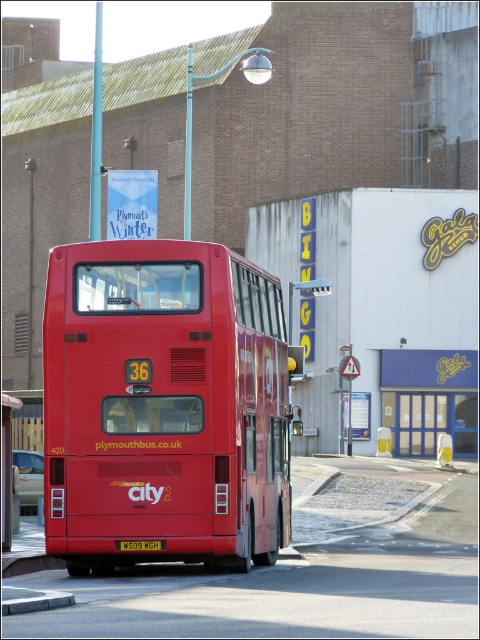
Question: Is metallic silver pole at left above yellow matte license plate at rear?

Choices:
 (A) yes
 (B) no

Answer: (B)

Question: Is metallic silver pole at left wider than yellow matte license plate at rear?

Choices:
 (A) no
 (B) yes

Answer: (A)

Question: Which point is closer to the camera taking this photo?

Choices:
 (A) (90, 470)
 (B) (156, 540)

Answer: (B)

Question: Is matte red bus at center smaller than yellow matte license plate at rear?

Choices:
 (A) no
 (B) yes

Answer: (A)

Question: Which object is positioned farthest from the metallic silver pole at left?

Choices:
 (A) yellow matte license plate at rear
 (B) matte red bus at center

Answer: (B)

Question: Which of these objects is positioned farthest from the matte red bus at center?

Choices:
 (A) yellow matte license plate at rear
 (B) metallic silver pole at left

Answer: (B)